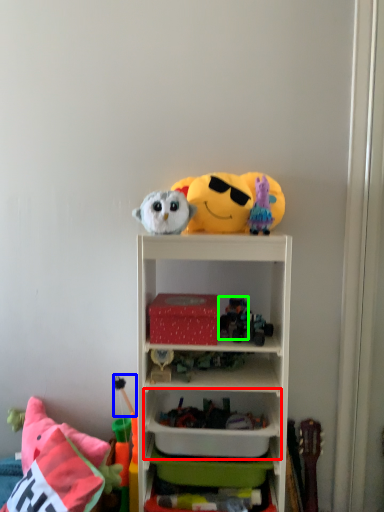
Question: Which is farther away from cabinet (highlighted by a red box)? toy (highlighted by a blue box) or toy (highlighted by a green box)?

Choices:
 (A) toy
 (B) toy

Answer: (B)